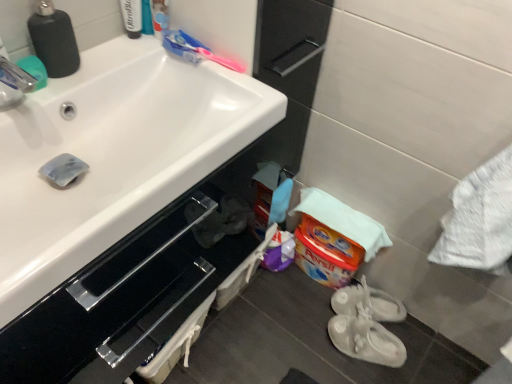
At what (x,y) coordinates should I click in order to perform the action: click on vacant space that is in between translucent plastic toothbrush at upper center, positioned as the second toiletry in left-to-right order, and black matte soap dispenser at upper left. Please return your answer as a coordinate pair (x, y). The height and width of the screenshot is (384, 512). Looking at the image, I should click on (121, 53).